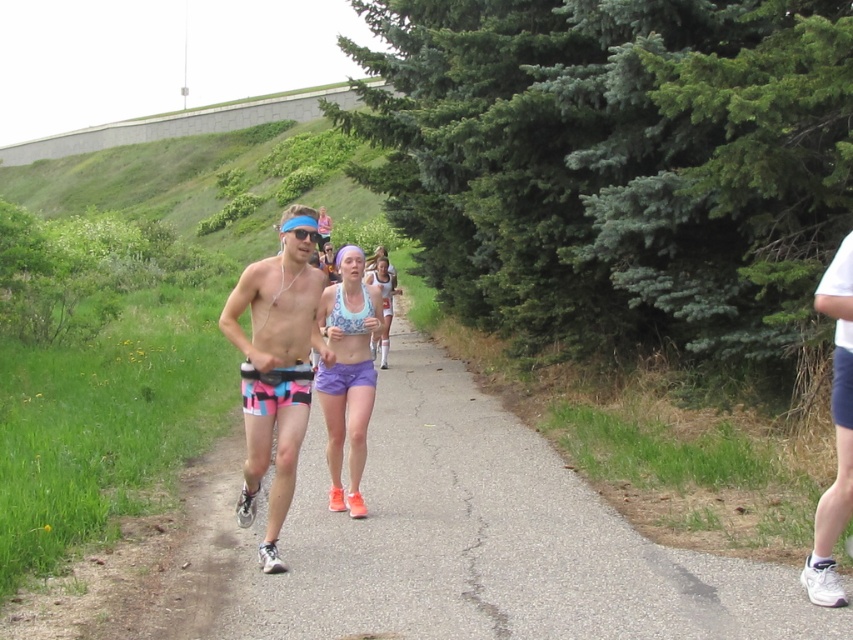
Question: Does neon pink spandex shorts at center have a smaller size compared to white cotton shirt at right?

Choices:
 (A) no
 (B) yes

Answer: (A)

Question: Is neon pink spandex shorts at center bigger than purple fabric shorts at center?

Choices:
 (A) no
 (B) yes

Answer: (B)

Question: Where is purple fabric shorts at center located in relation to matte blue tank top at center in the image?

Choices:
 (A) right
 (B) left

Answer: (A)

Question: Which object appears closest to the camera in this image?

Choices:
 (A) white cotton shirt at right
 (B) matte blue tank top at center

Answer: (A)

Question: Considering the real-world distances, which object is closest to the neon pink spandex shorts at center?

Choices:
 (A) purple fabric shorts at center
 (B) white cotton shirt at right
 (C) white matte bikini top at center
 (D) matte blue tank top at center

Answer: (C)

Question: Estimate the real-world distances between objects in this image. Which object is closer to the neon pink spandex shorts at center?

Choices:
 (A) purple fabric shorts at center
 (B) matte blue tank top at center

Answer: (A)